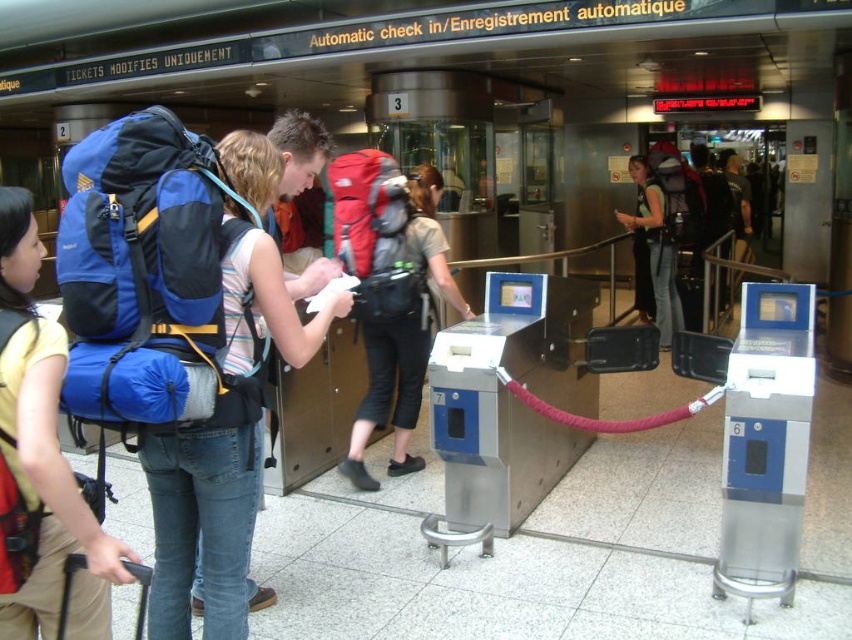
Between blue fabric backpack at center and matte red backpack at center, which one appears on the right side from the viewer's perspective?

matte red backpack at center

Can you confirm if blue fabric backpack at center is taller than matte red backpack at center?

Yes.

Who is more distant from viewer, (321, 129) or (396, 264)?

Positioned behind is point (396, 264).

The image size is (852, 640). What are the coordinates of `blue fabric backpack at center` in the screenshot? It's located at (204, 522).

Between point (360, 316) and point (672, 259), which one is positioned behind?

Point (672, 259)

Is point (395, 428) closer to camera compared to point (632, 170)?

Yes, point (395, 428) is closer to viewer.

Is point (392, 464) farther from camera compared to point (669, 260)?

No, it is in front of (669, 260).

At what (x,y) coordinates should I click in order to perform the action: click on matte red backpack at center. Please return your answer as a coordinate pair (x, y). This screenshot has width=852, height=640. Looking at the image, I should click on (390, 292).

In the scene shown: Who is more forward, (203,513) or (33,563)?

Positioned in front is point (33,563).

Can you confirm if blue fabric backpack at center is shorter than matte blue backpack at left?

No.

Between point (199, 518) and point (56, 348), which one is positioned behind?

The point (199, 518) is more distant.

At what (x,y) coordinates should I click in order to perform the action: click on blue fabric backpack at center. Please return your answer as a coordinate pair (x, y). This screenshot has height=640, width=852. Looking at the image, I should click on (204, 522).